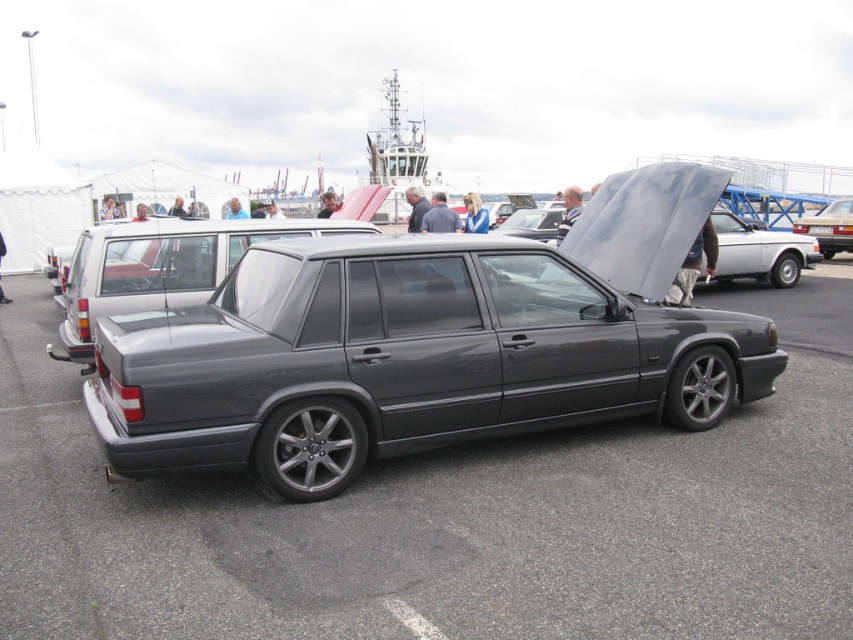
Is point (695, 413) closer to viewer compared to point (827, 227)?

Yes, it is.

Locate an element on the screen. This screenshot has height=640, width=853. satin black minivan at center is located at coordinates (427, 344).

From the picture: Can you confirm if satin black car at center is thinner than matte black sedan at center?

Incorrect, satin black car at center's width is not less than matte black sedan at center's.

Which is behind, point (647, 522) or point (834, 227)?

Point (834, 227)

What do you see at coordinates (448, 518) in the screenshot?
I see `satin black car at center` at bounding box center [448, 518].

Where is `satin black car at center`? Image resolution: width=853 pixels, height=640 pixels. satin black car at center is located at coordinates (448, 518).

Can you confirm if satin black minivan at center is smaller than matte gray minivan at center?

No, satin black minivan at center is not smaller than matte gray minivan at center.

Does satin black minivan at center have a greater height compared to matte gray minivan at center?

Yes, satin black minivan at center is taller than matte gray minivan at center.

Does point (399, 365) lie behind point (51, 356)?

No, (399, 365) is in front of (51, 356).

I want to click on satin black minivan at center, so click(427, 344).